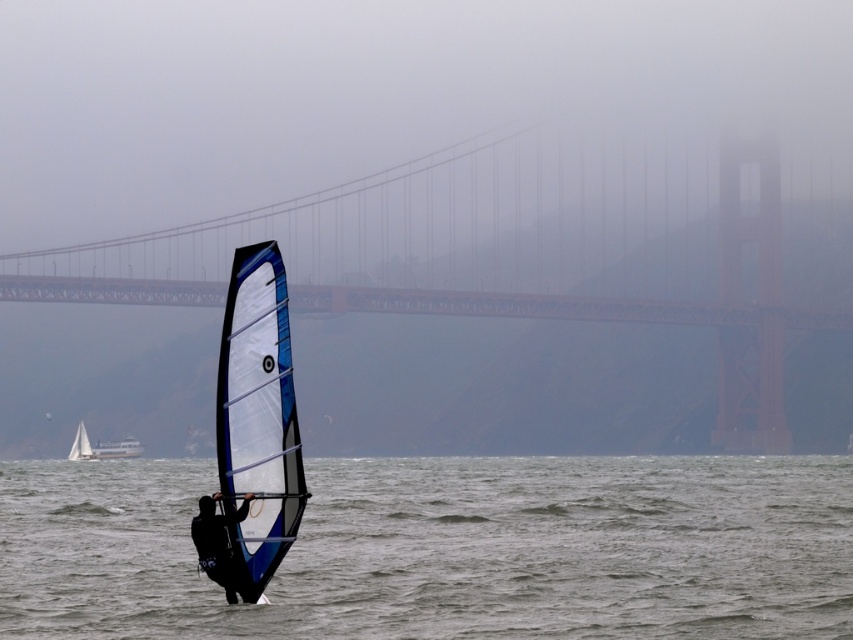
Question: Estimate the real-world distances between objects in this image. Which object is closer to the translucent blue water at center?

Choices:
 (A) blue/white composite sail at center
 (B) red metal bridge at center

Answer: (A)

Question: Does translucent blue water at center appear under blue/white composite sail at center?

Choices:
 (A) no
 (B) yes

Answer: (B)

Question: Observing the image, what is the correct spatial positioning of translucent blue water at center in reference to white plastic boat at lower left?

Choices:
 (A) right
 (B) left

Answer: (A)

Question: Which point is farther to the camera?

Choices:
 (A) (76, 444)
 (B) (225, 324)
 (C) (312, 561)
 (D) (172, 294)

Answer: (D)

Question: Can you confirm if translucent blue water at center is smaller than white plastic boat at lower left?

Choices:
 (A) yes
 (B) no

Answer: (B)

Question: Which point is closer to the camera?

Choices:
 (A) (84, 452)
 (B) (241, 422)

Answer: (B)